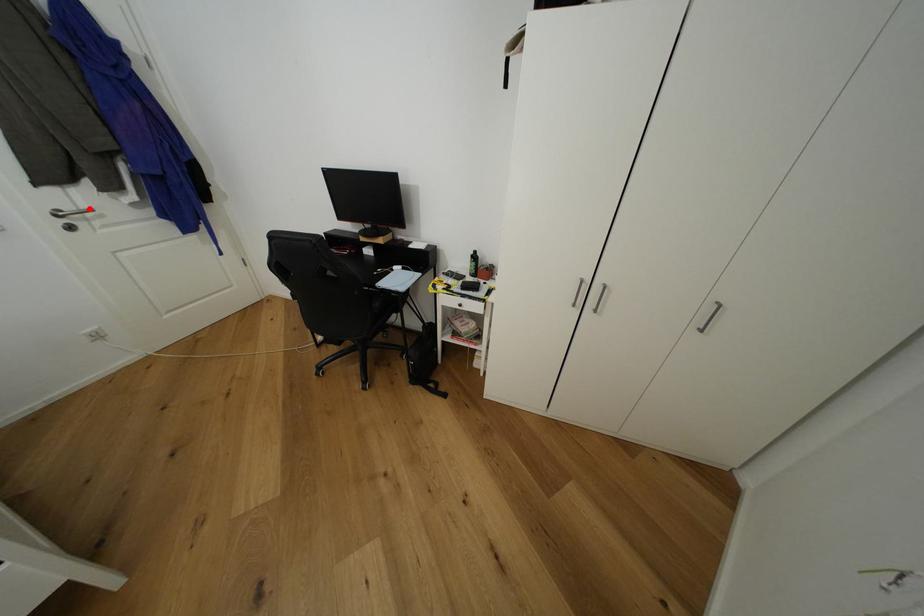
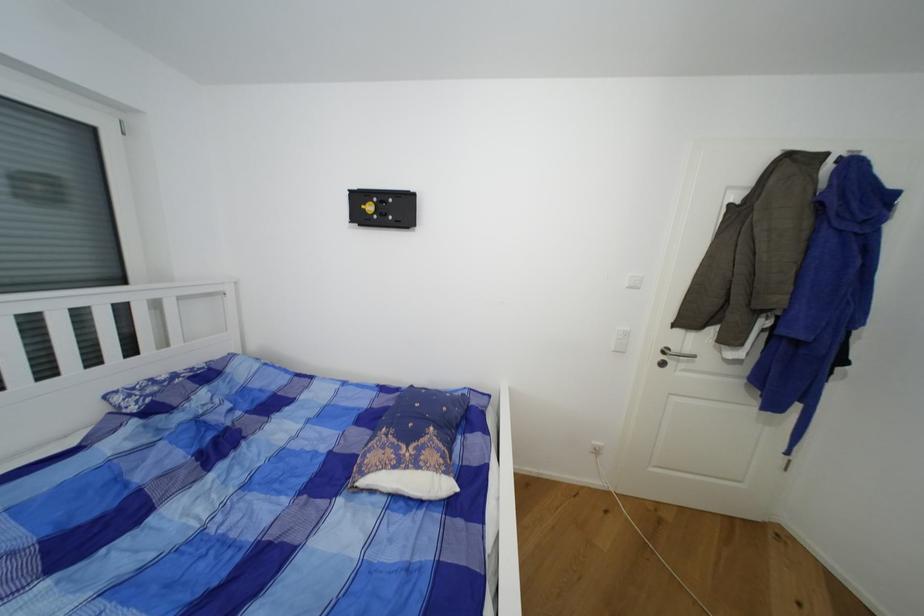
Question: I am providing you with two images of the same scene from different viewpoints. In image1, a red point is highlighted. Considering the same 3D point in image2, which of the following is correct?

Choices:
 (A) It is closer
 (B) It is farther

Answer: (A)